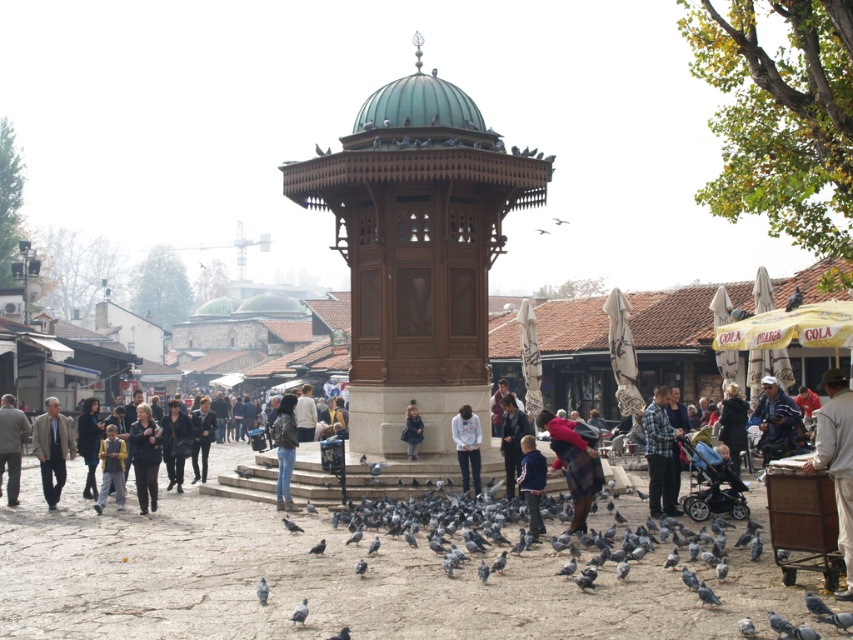
From the picture: You are a tourist standing in the square and want to take a photo of the white matte hoodie at center without any birds in the frame. Is the gray matte bird at lower center currently blocking your view of the hoodie?

The gray matte bird at lower center is behind the white matte hoodie at center, so it is not blocking the view of the hoodie. You can take the photo without any obstruction from the bird.

You are standing in the public square and notice a white matte hoodie at center and a white feathered bird at center. Which object is closer to the ground?

The white matte hoodie at center is positioned under the white feathered bird at center, so the hoodie is closer to the ground than the bird.